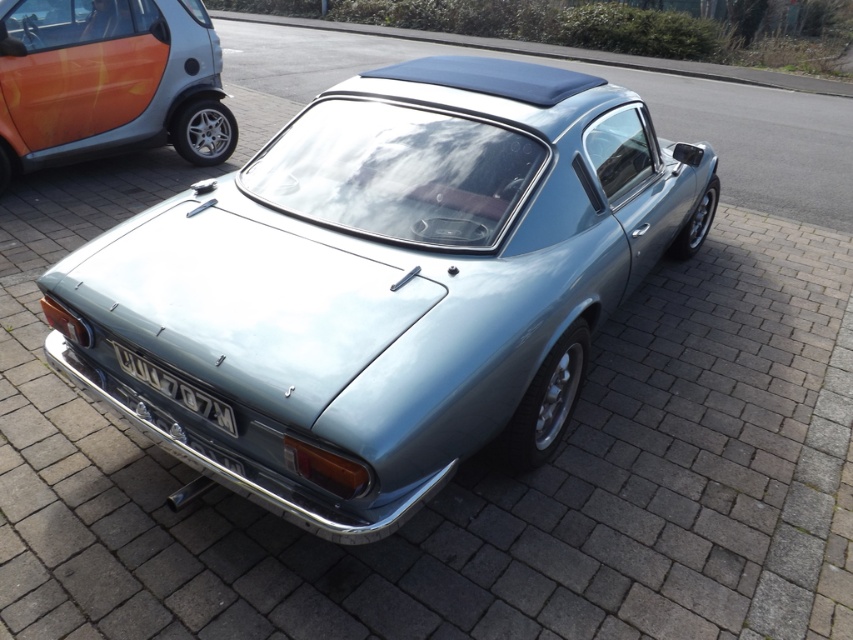
You are a delivery person trying to park your orange metallic car at left in the driveway. The parking spot requires that your car must be entirely to the right of the gray metallic license plate at lower center. Can you park your car in this spot based on the current position?

The orange metallic car at left is currently to the left of the gray metallic license plate at lower center, so it cannot be parked in the spot as it violates the requirement to be entirely to the right of the license plate.

Please provide the 2D coordinates of the satin silver car at center in the image.

The satin silver car at center is located at coordinates (386, 284).

You are a parking attendant who needs to fit both the satin silver car at center and the orange metallic car at left into a parking spot that can only accommodate vehicles up to the height of the shorter car. Which car should you lower or adjust?

The satin silver car at center is taller than the orange metallic car at left, so you should lower or adjust the satin silver car at center to fit within the height restriction.